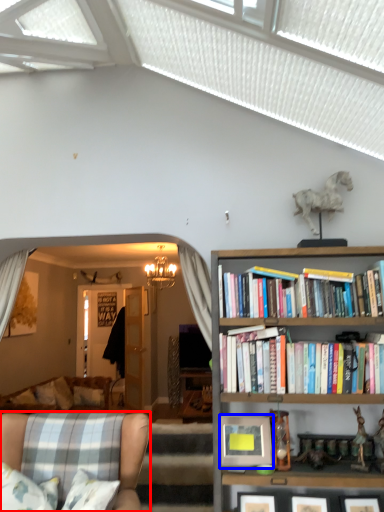
Question: Among these objects, which one is nearest to the camera, chair (highlighted by a red box) or picture frame (highlighted by a blue box)?

Choices:
 (A) chair
 (B) picture frame

Answer: (A)